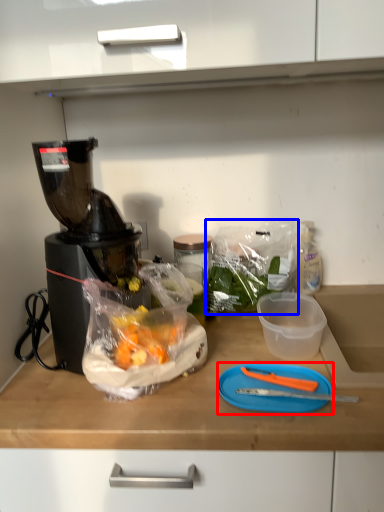
Question: Which object is further to the camera taking this photo, cutting board (highlighted by a red box) or plastic bag (highlighted by a blue box)?

Choices:
 (A) cutting board
 (B) plastic bag

Answer: (B)